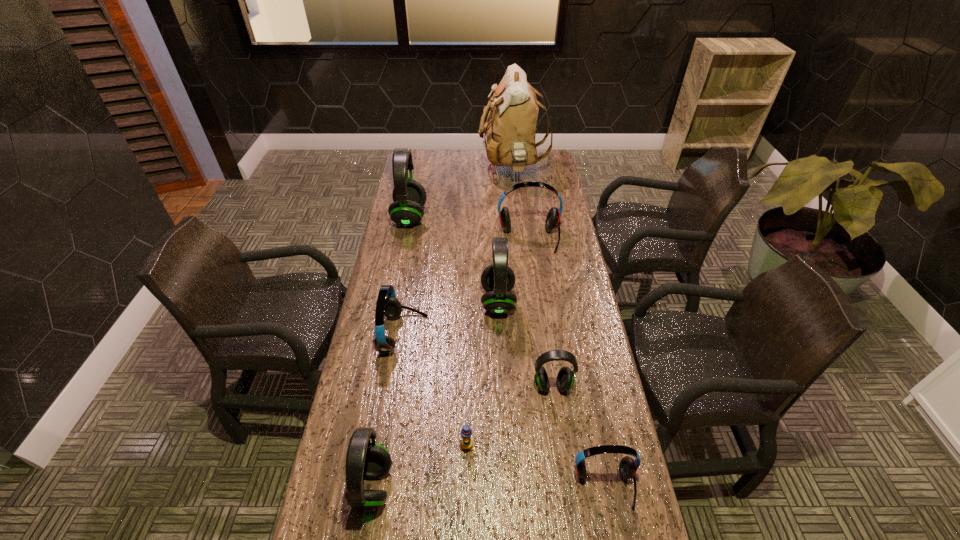
At what (x,y) coordinates should I click in order to perform the action: click on object that is at the far right corner. Please return your answer as a coordinate pair (x, y). The height and width of the screenshot is (540, 960). Looking at the image, I should click on (510, 130).

This screenshot has width=960, height=540. What are the coordinates of `vacant space at the far edge` in the screenshot? It's located at (478, 166).

This screenshot has width=960, height=540. In the image, there is a desktop. In order to click on vacant space at the left edge in this screenshot , I will do `click(365, 479)`.

Locate an element on the screen. The image size is (960, 540). vacant region at the right edge of the desktop is located at coordinates (548, 200).

Image resolution: width=960 pixels, height=540 pixels. Find the location of `vacant space at the far left corner`. vacant space at the far left corner is located at coordinates (437, 161).

The image size is (960, 540). What are the coordinates of `free space between the brown backpack and the smallest red headset` in the screenshot? It's located at (559, 328).

Where is `free space that is in between the farthest red headset and the backpack`? The height and width of the screenshot is (540, 960). free space that is in between the farthest red headset and the backpack is located at coordinates (520, 204).

Image resolution: width=960 pixels, height=540 pixels. What are the coordinates of `empty space that is in between the second tallest object and the farthest object` in the screenshot? It's located at (461, 193).

At what (x,y) coordinates should I click in order to perform the action: click on free space between the tallest headset and the nearest red headset. Please return your answer as a coordinate pair (x, y). Looking at the image, I should click on [507, 352].

Locate an element on the screen. This screenshot has height=540, width=960. vacant space in between the third farthest black headset and the second biggest black headset is located at coordinates (525, 343).